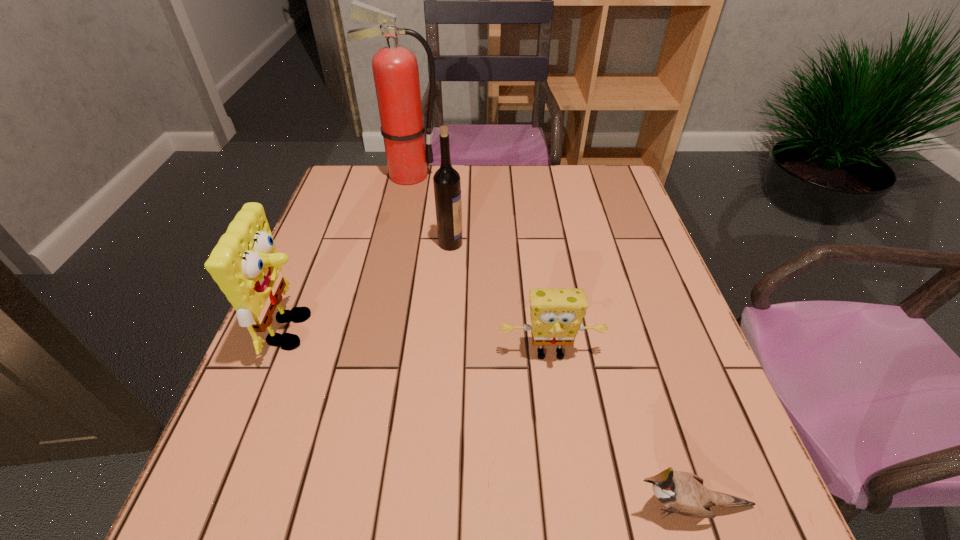
Find the location of a particular element. The height and width of the screenshot is (540, 960). free space between the bird and the taller sponge is located at coordinates (492, 418).

You are a GUI agent. You are given a task and a screenshot of the screen. Output one action in this format:
    pyautogui.click(x=<x>, y=<y>)
    Task: Click on the free space between the leftmost object and the wine bottle
    
    Given the screenshot: What is the action you would take?
    pyautogui.click(x=372, y=287)

Where is `vacant space that's between the taller sponge and the nearest object`? The image size is (960, 540). vacant space that's between the taller sponge and the nearest object is located at coordinates (492, 418).

Identify the location of free spot between the shorter sponge and the wine bottle. Image resolution: width=960 pixels, height=540 pixels. (500, 298).

The height and width of the screenshot is (540, 960). Identify the location of empty space between the shorter sponge and the wine bottle. (500, 298).

In order to click on empty location between the bird and the right sponge in this screenshot , I will do `click(620, 430)`.

Where is `free area in between the left sponge and the right sponge`? The width and height of the screenshot is (960, 540). free area in between the left sponge and the right sponge is located at coordinates (422, 342).

Locate which object is the second closest to the shortest object. Please provide its 2D coordinates. Your answer should be formatted as a tuple, i.e. [(x, y)], where the tuple contains the x and y coordinates of a point satisfying the conditions above.

[(245, 264)]

Select which object is the third closest to the right sponge. Please provide its 2D coordinates. Your answer should be formatted as a tuple, i.e. [(x, y)], where the tuple contains the x and y coordinates of a point satisfying the conditions above.

[(245, 264)]